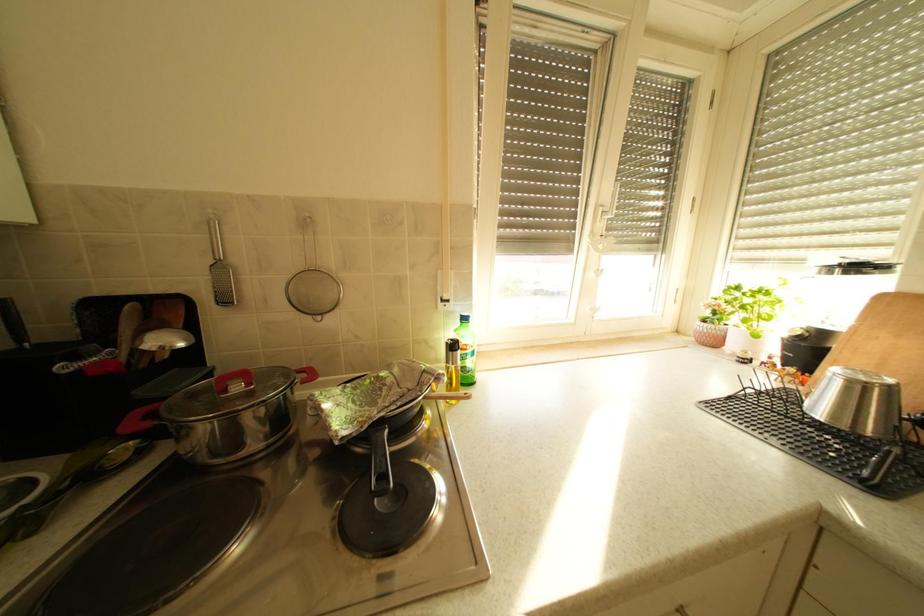
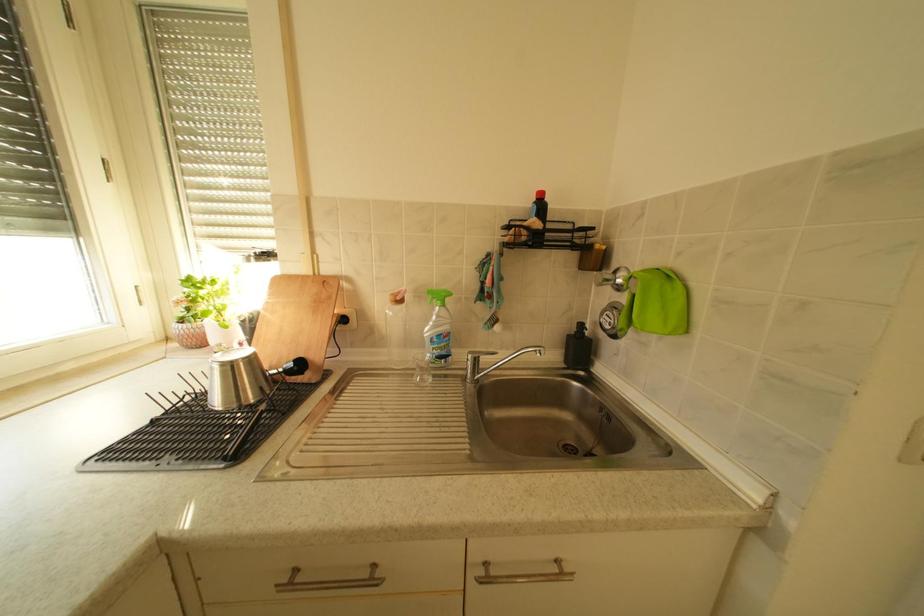
Question: The camera is either moving clockwise (left) or counter-clockwise (right) around the object. The first image is from the beginning of the video and the second image is from the end. Is the camera moving left or right when shooting the video?

Choices:
 (A) Left
 (B) Right

Answer: (A)